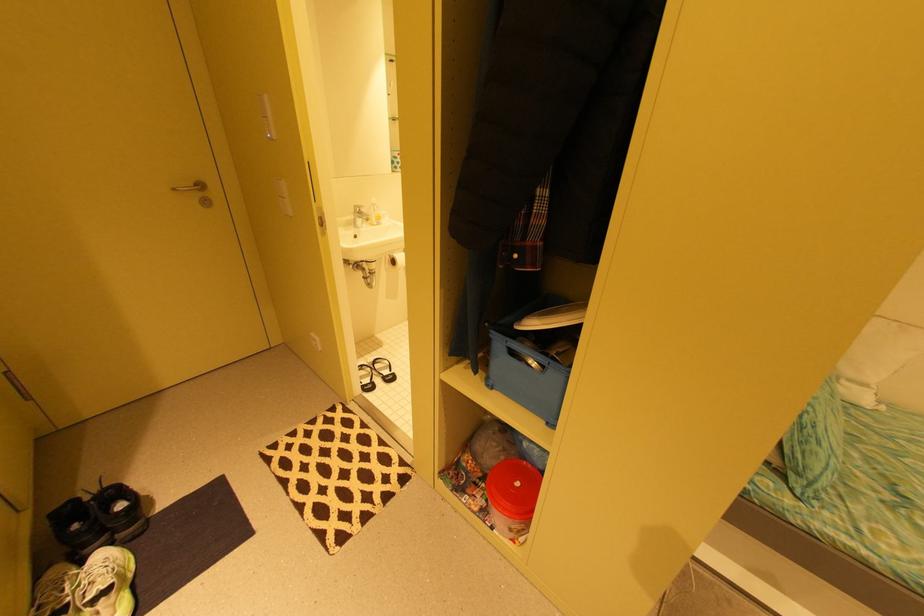
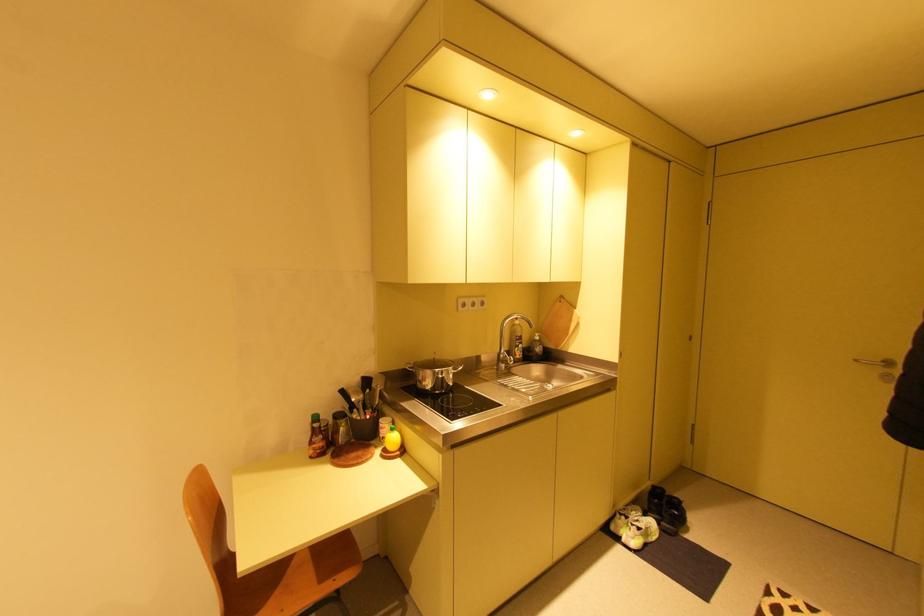
Locate, in the second image, the point that corresponds to [179,190] in the first image.

(861, 361)